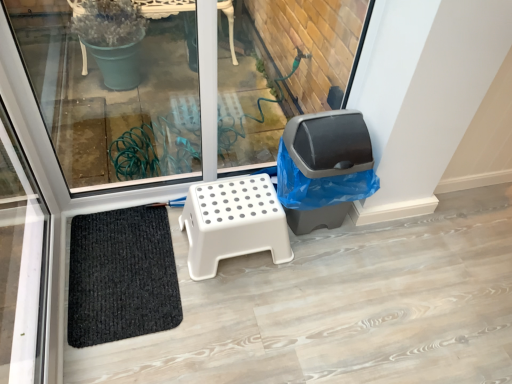
Image resolution: width=512 pixels, height=384 pixels. I want to click on vacant area located to the right-hand side of gray plastic trash can at center right, so click(x=383, y=245).